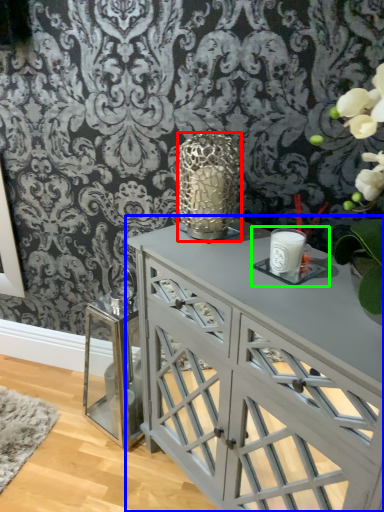
Question: Which is nearer to the candle holder (highlighted by a red box)? table (highlighted by a blue box) or candle holder (highlighted by a green box).

Choices:
 (A) table
 (B) candle holder

Answer: (B)